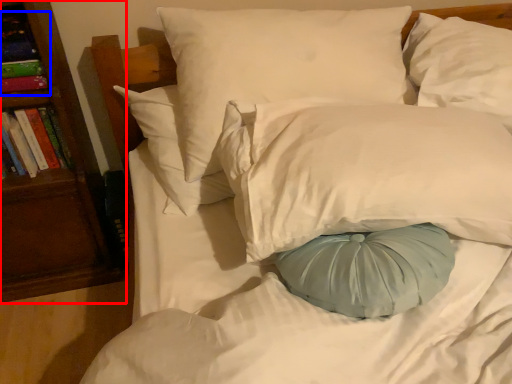
Question: Among these objects, which one is farthest to the camera, bookshelf (highlighted by a red box) or book (highlighted by a blue box)?

Choices:
 (A) bookshelf
 (B) book

Answer: (B)